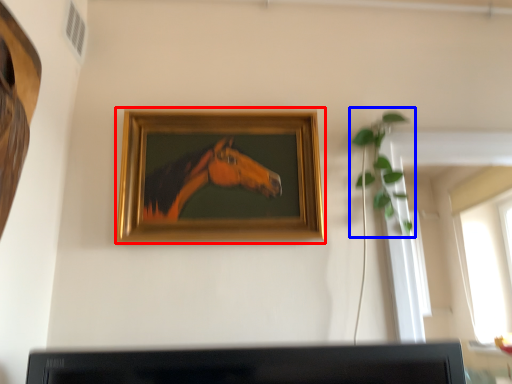
Question: Which point is further to the camera, picture frame (highlighted by a red box) or plant (highlighted by a blue box)?

Choices:
 (A) picture frame
 (B) plant

Answer: (B)